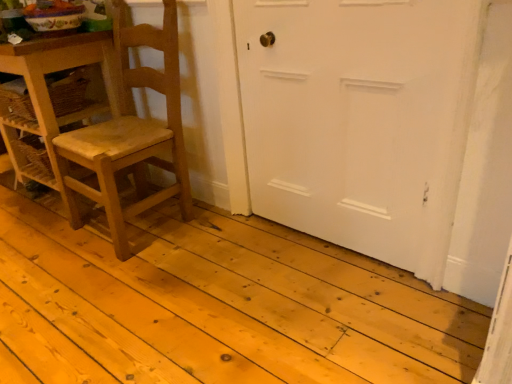
The width and height of the screenshot is (512, 384). I want to click on vacant space to the left of white matte door at center, so click(x=220, y=261).